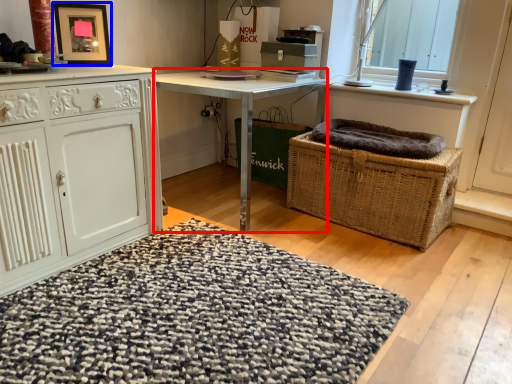
Question: Which of the following is the closest to the observer, desk (highlighted by a red box) or picture frame (highlighted by a blue box)?

Choices:
 (A) desk
 (B) picture frame

Answer: (B)